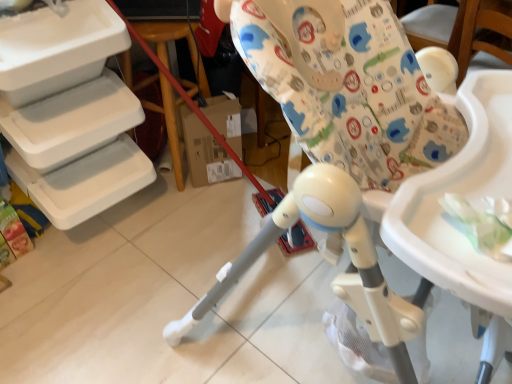
This screenshot has height=384, width=512. What are the coordinates of `free space in front of wooden at left` in the screenshot? It's located at (199, 217).